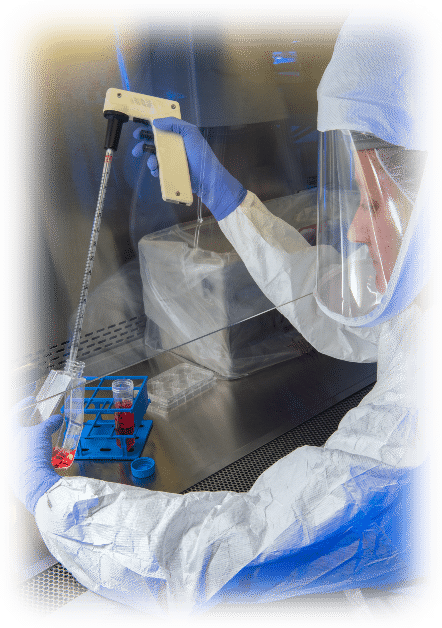
The height and width of the screenshot is (628, 442). Find the location of `air vent holes`. air vent holes is located at coordinates (48, 588).